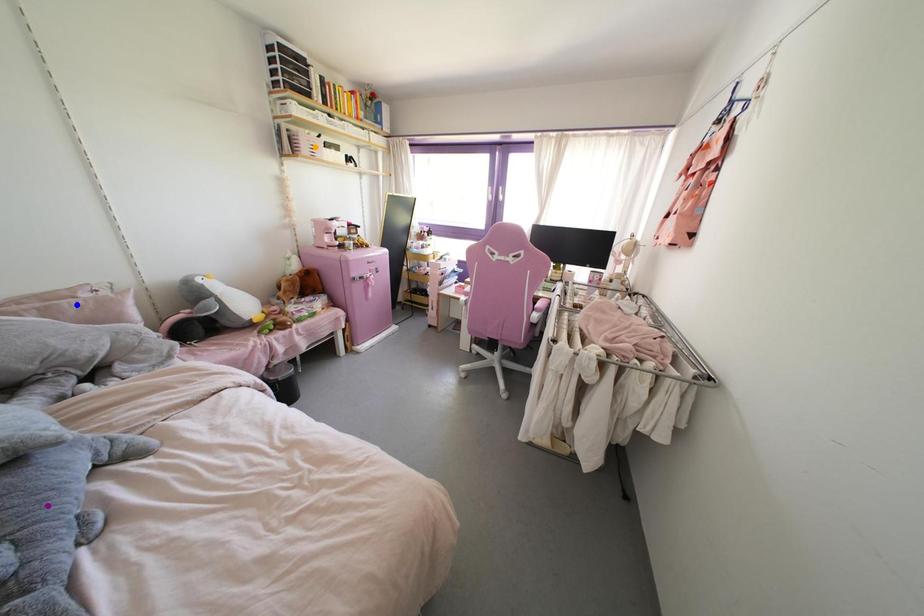
Order these from farthest to nearest:
purple point, orange point, blue point

orange point, blue point, purple point